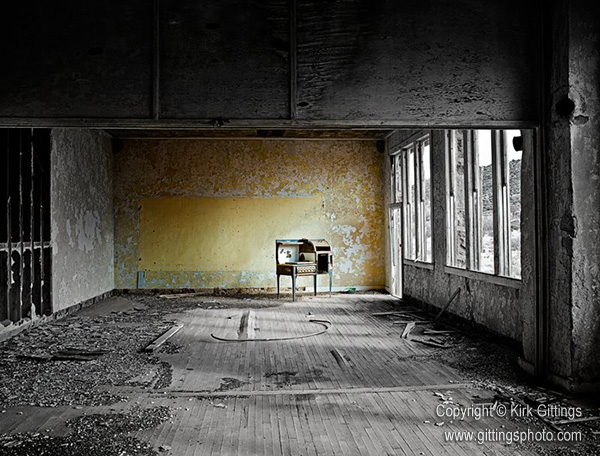
In order to click on walls in this screenshot , I will do `click(461, 281)`, `click(92, 228)`, `click(580, 243)`.